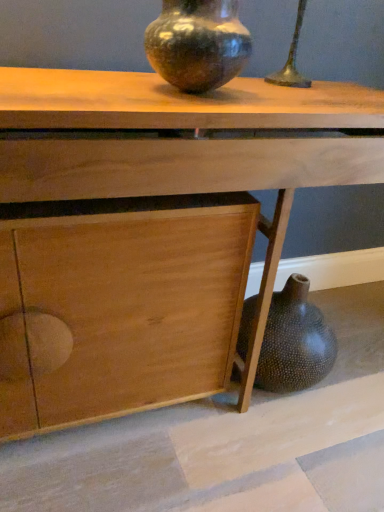
Describe the element at coordinates (198, 44) in the screenshot. Image resolution: width=384 pixels, height=512 pixels. I see `speckled dark brown vase at upper center` at that location.

You are a GUI agent. You are given a task and a screenshot of the screen. Output one action in this format:
    pyautogui.click(x=<x>, y=<y>)
    Task: Click on the speckled dark brown vase at upper center
    The height and width of the screenshot is (512, 384).
    Given the screenshot: What is the action you would take?
    pyautogui.click(x=198, y=44)

What do you see at coordinates (150, 231) in the screenshot? This screenshot has height=512, width=384. I see `wooden table at center` at bounding box center [150, 231].

Where is `wooden table at center`? This screenshot has width=384, height=512. wooden table at center is located at coordinates (150, 231).

Identify the location of speckled dark brown vase at upper center. (198, 44).

Between wooden table at center and speckled dark brown vase at upper center, which one appears on the left side from the viewer's perspective?

speckled dark brown vase at upper center.

Which is in front, wooden table at center or speckled dark brown vase at upper center?

wooden table at center is more forward.

Considering the points (93, 298) and (192, 92), which point is behind, point (93, 298) or point (192, 92)?

The point (93, 298) is behind.

From the image's perspective, is wooden table at center beneath speckled dark brown vase at upper center?

Indeed, from the image's perspective, wooden table at center is shown beneath speckled dark brown vase at upper center.

From a real-world perspective, is wooden table at center physically below speckled dark brown vase at upper center?

Yes, from a real-world perspective, wooden table at center is beneath speckled dark brown vase at upper center.

Is wooden table at center wider or thinner than speckled dark brown vase at upper center?

Clearly, wooden table at center has more width compared to speckled dark brown vase at upper center.

Is wooden table at center taller than speckled dark brown vase at upper center?

Yes, wooden table at center is taller than speckled dark brown vase at upper center.

Is wooden table at center bigger than speckled dark brown vase at upper center?

Yes, wooden table at center is bigger than speckled dark brown vase at upper center.

Is wooden table at center spatially inside speckled dark brown vase at upper center, or outside of it?

wooden table at center lies outside speckled dark brown vase at upper center.

Is wooden table at center far away from speckled dark brown vase at upper center?

wooden table at center is near speckled dark brown vase at upper center, not far away.

Is wooden table at center facing towards speckled dark brown vase at upper center?

No, wooden table at center does not turn towards speckled dark brown vase at upper center.

Can you tell me how much wooden table at center and speckled dark brown vase at upper center differ in facing direction?

There is a 2.6-degree angle between the facing directions of wooden table at center and speckled dark brown vase at upper center.

Identify the location of vase above the wooden table at center (from the image's perspective). (198, 44).

In the image, is speckled dark brown vase at upper center on the left side or the right side of wooden table at center?

speckled dark brown vase at upper center is to the left of wooden table at center.

Is speckled dark brown vase at upper center in front of or behind wooden table at center in the image?

speckled dark brown vase at upper center is positioned farther from the viewer than wooden table at center.

Is point (240, 47) positioned in front of point (153, 262)?

Yes.

From the image's perspective, is speckled dark brown vase at upper center below wooden table at center?

No.

From a real-world perspective, is speckled dark brown vase at upper center located beneath wooden table at center?

No.

Considering the relative sizes of speckled dark brown vase at upper center and wooden table at center in the image provided, is speckled dark brown vase at upper center thinner than wooden table at center?

Correct, the width of speckled dark brown vase at upper center is less than that of wooden table at center.

Looking at this image, who is shorter, speckled dark brown vase at upper center or wooden table at center?

With less height is speckled dark brown vase at upper center.

Based on their sizes in the image, would you say speckled dark brown vase at upper center is bigger or smaller than wooden table at center?

speckled dark brown vase at upper center is smaller than wooden table at center.

Is wooden table at center a part of speckled dark brown vase at upper center?

No, wooden table at center is not surrounded by speckled dark brown vase at upper center.

Would you say speckled dark brown vase at upper center is a long distance from wooden table at center?

No, there isn't a large distance between speckled dark brown vase at upper center and wooden table at center.

Is speckled dark brown vase at upper center facing towards wooden table at center?

No, speckled dark brown vase at upper center is not aimed at wooden table at center.

What's the angular difference between speckled dark brown vase at upper center and wooden table at center's facing directions?

The facing directions of speckled dark brown vase at upper center and wooden table at center are 2.6 degrees apart.

Locate an element on the screen. table on the right of the speckled dark brown vase at upper center is located at coordinates (150, 231).

The height and width of the screenshot is (512, 384). Identify the location of table that appears below the speckled dark brown vase at upper center (from a real-world perspective). (150, 231).

Locate an element on the screen. table below the speckled dark brown vase at upper center (from the image's perspective) is located at coordinates (150, 231).